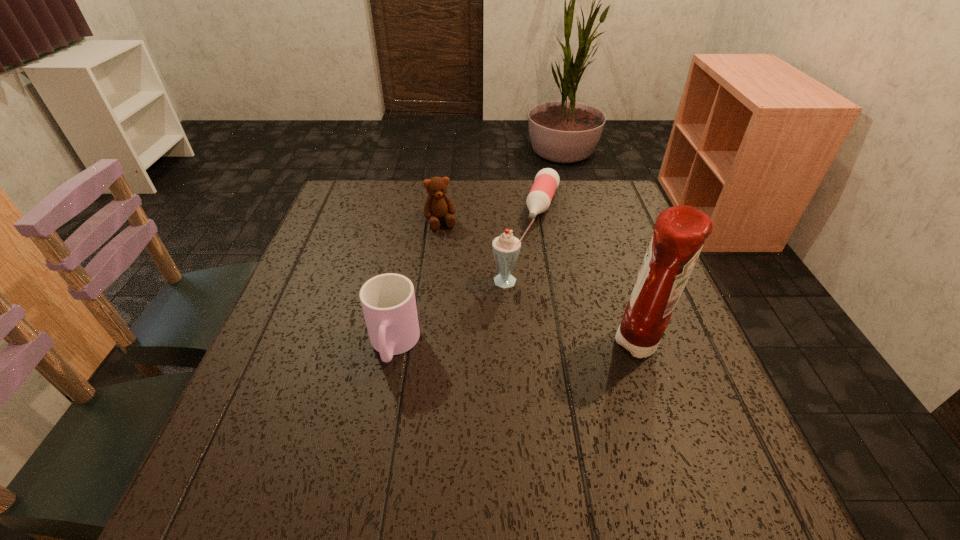
I want to click on vacant region between the cup and the bottle, so click(468, 276).

Find the location of a particular element. empty space between the tallest object and the teddy bear is located at coordinates 540,284.

Where is `empty space that is in between the rightmost object and the teddy bear`? This screenshot has width=960, height=540. empty space that is in between the rightmost object and the teddy bear is located at coordinates (540, 284).

Where is `free spot between the tallest object and the bottle`? This screenshot has height=540, width=960. free spot between the tallest object and the bottle is located at coordinates (591, 275).

This screenshot has height=540, width=960. Find the location of `free space between the teddy bear and the cup`. free space between the teddy bear and the cup is located at coordinates (417, 284).

What are the coordinates of `vacant space in between the third nearest object and the cup` in the screenshot? It's located at (452, 313).

You are a GUI agent. You are given a task and a screenshot of the screen. Output one action in this format:
    pyautogui.click(x=<x>, y=<y>)
    Task: Click on the object that is the closest to the third nearest object
    This screenshot has width=960, height=540.
    Given the screenshot: What is the action you would take?
    pyautogui.click(x=547, y=180)

Select which object appears as the third closest to the teddy bear. Please provide its 2D coordinates. Your answer should be formatted as a tuple, i.e. [(x, y)], where the tuple contains the x and y coordinates of a point satisfying the conditions above.

[(388, 301)]

Identify the location of free space that satisfies the following two spatial constraints: 1. on the front side of the third farthest object; 2. on the left side of the rightmost object. Image resolution: width=960 pixels, height=540 pixels. (515, 345).

This screenshot has height=540, width=960. Identify the location of vacant region that satisfies the following two spatial constraints: 1. on the front side of the rightmost object; 2. on the right side of the milkshake. (515, 345).